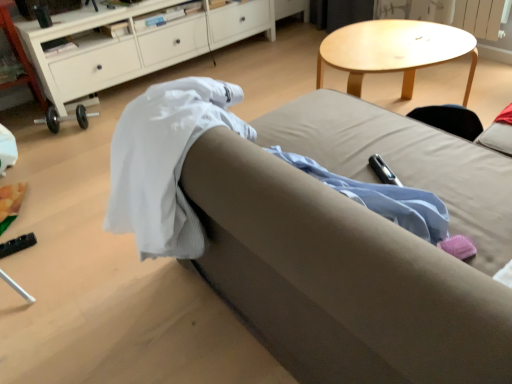
Question: In the image, is light brown fabric couch at center on the left side or the right side of white wood cabinet at upper left?

Choices:
 (A) left
 (B) right

Answer: (B)

Question: From the image's perspective, is light brown fabric couch at center positioned above or below white wood cabinet at upper left?

Choices:
 (A) below
 (B) above

Answer: (A)

Question: In the image, is light brown fabric couch at center positioned in front of or behind white wood cabinet at upper left?

Choices:
 (A) behind
 (B) front

Answer: (B)

Question: Is white wood cabinet at upper left taller or shorter than light brown fabric couch at center?

Choices:
 (A) short
 (B) tall

Answer: (A)

Question: Is point (214, 21) positioned closer to the camera than point (302, 367)?

Choices:
 (A) closer
 (B) farther

Answer: (B)

Question: In terms of width, does white wood cabinet at upper left look wider or thinner when compared to light brown fabric couch at center?

Choices:
 (A) thin
 (B) wide

Answer: (A)

Question: Which is correct: white wood cabinet at upper left is inside light brown fabric couch at center, or outside of it?

Choices:
 (A) outside
 (B) inside

Answer: (A)